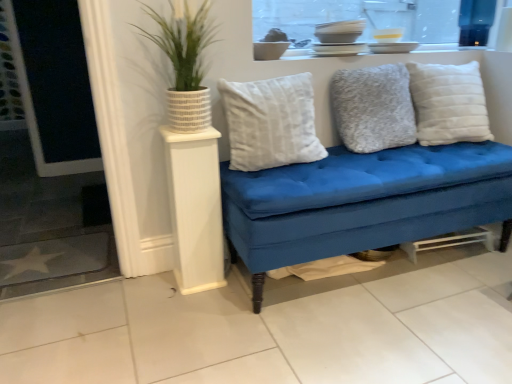
In order to click on vacant space to the right of white wood side table at left in this screenshot , I will do `click(240, 273)`.